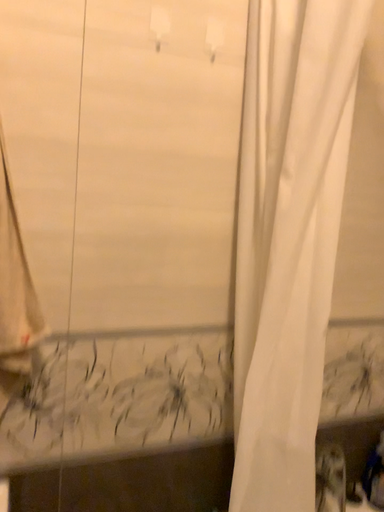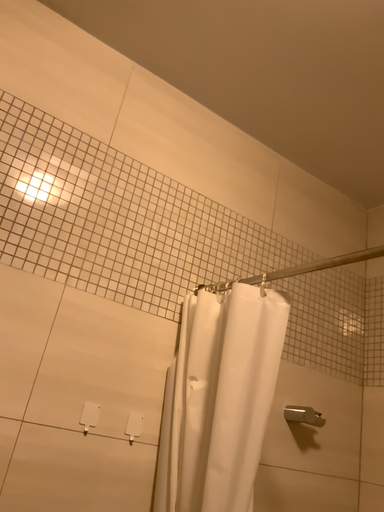
Question: Which way did the camera rotate in the video?

Choices:
 (A) rotated upward
 (B) rotated downward

Answer: (A)